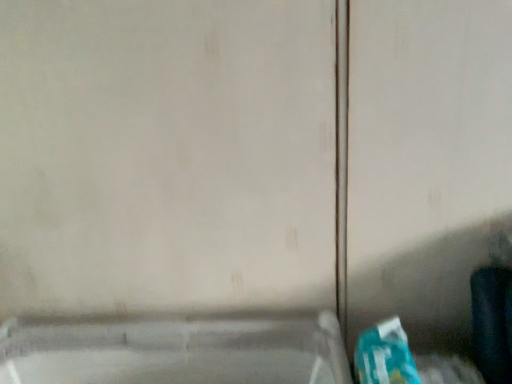
At what (x,y) coordinates should I click in order to perform the action: click on teal plastic bag at lower right. Please return your answer as a coordinate pair (x, y). Looking at the image, I should click on (384, 355).

Image resolution: width=512 pixels, height=384 pixels. Describe the element at coordinates (384, 355) in the screenshot. I see `teal plastic bag at lower right` at that location.

Identify the location of teal plastic bag at lower right. The height and width of the screenshot is (384, 512). (384, 355).